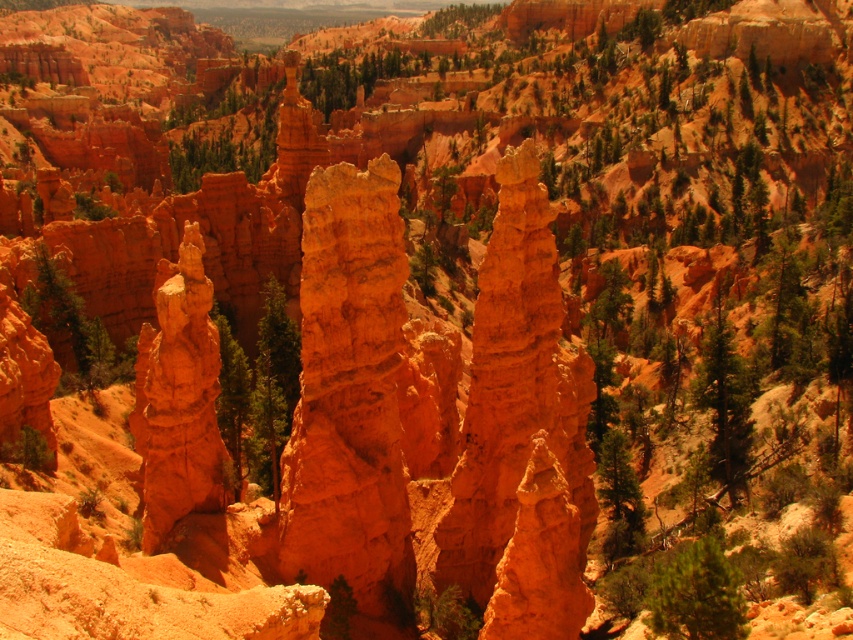
Question: Which is farther from the green textured tree at right?

Choices:
 (A) orange sandstone hoodoo at center
 (B) green textured tree at lower right

Answer: (A)

Question: Is green textured tree at lower right in front of green textured tree at right?

Choices:
 (A) no
 (B) yes

Answer: (B)

Question: Among these objects, which one is nearest to the camera?

Choices:
 (A) orange sandstone hoodoo at center
 (B) green textured tree at right

Answer: (A)

Question: Considering the relative positions of orange sandstone hoodoo at center and green textured tree at right in the image provided, where is orange sandstone hoodoo at center located with respect to green textured tree at right?

Choices:
 (A) above
 (B) below

Answer: (B)

Question: Is green textured tree at lower right to the right of green textured tree at right from the viewer's perspective?

Choices:
 (A) no
 (B) yes

Answer: (A)

Question: Which point is farther to the camera?

Choices:
 (A) green textured tree at right
 (B) orange sandstone hoodoo at center
 (C) green textured tree at lower right

Answer: (A)